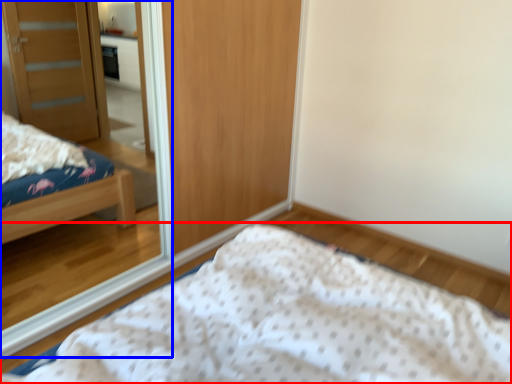
Question: Which object appears farthest to the camera in this image, bed (highlighted by a red box) or mirror (highlighted by a blue box)?

Choices:
 (A) bed
 (B) mirror

Answer: (B)